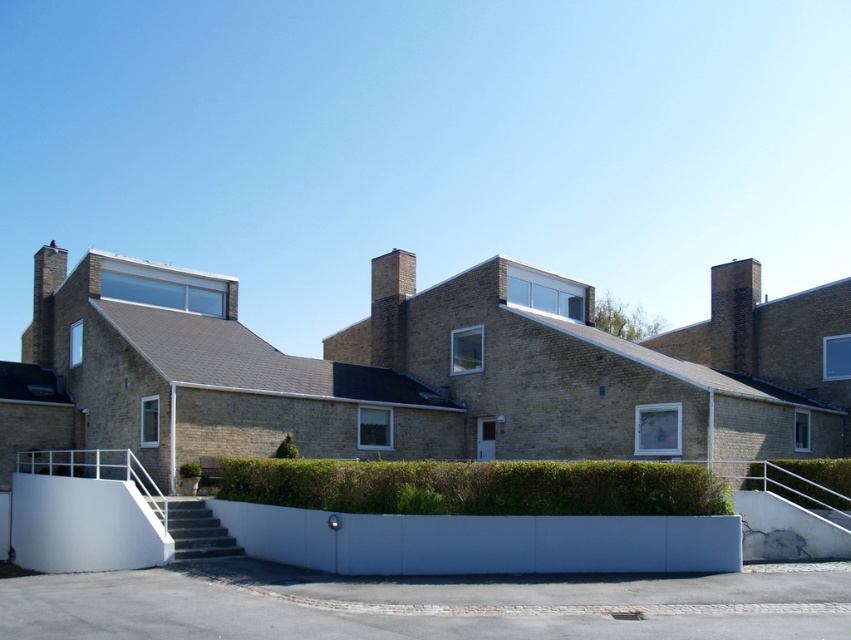
Can you confirm if green leafy hedge at center is smaller than green leafy hedge at lower right?

No.

Identify the location of green leafy hedge at center. (477, 486).

Locate an element on the screen. green leafy hedge at center is located at coordinates (477, 486).